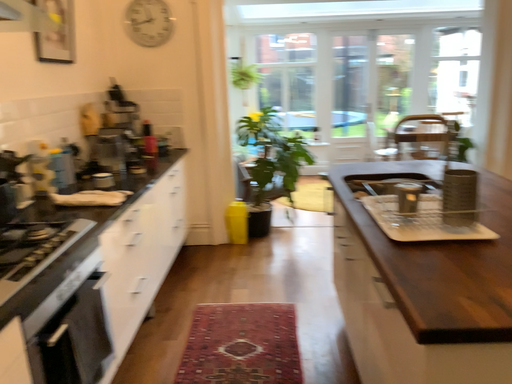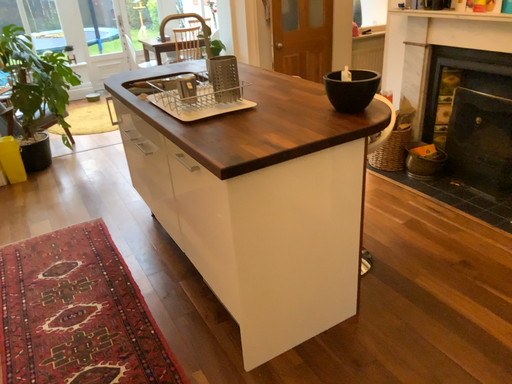
Question: How did the camera likely rotate when shooting the video?

Choices:
 (A) rotated left
 (B) rotated right

Answer: (B)